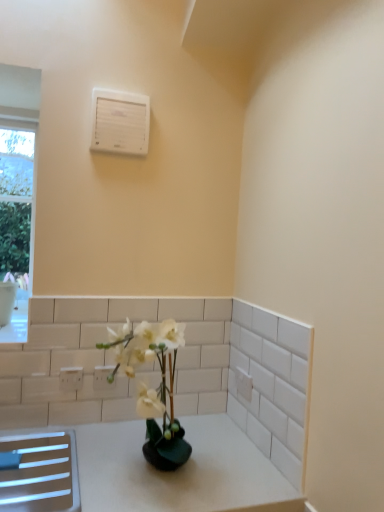
In order to face white glossy vase at center, should I rotate leftwards or rightwards?

Turn left approximately 5.754 degrees to face it.

Where is `white glossy vase at center`? The width and height of the screenshot is (384, 512). white glossy vase at center is located at coordinates click(x=151, y=388).

Between white glossy vase at center and white plastic electric outlet at lower left, the second electric outlet positioned from the back, which one is positioned behind?

white plastic electric outlet at lower left, the second electric outlet positioned from the back, is more distant.

Consider the image. Does white glossy vase at center have a lesser height compared to white plastic electric outlet at lower left, which is the first electric outlet from front to back?

No.

Does white glossy vase at center have a lesser width compared to white plastic electric outlet at lower left, which ranks as the 1th electric outlet in left-to-right order?

Incorrect, the width of white glossy vase at center is not less than that of white plastic electric outlet at lower left, which ranks as the 1th electric outlet in left-to-right order.

Would you say white glossy vase at center is inside or outside white plastic electric outlet at lower left, which is the first electric outlet from front to back?

white glossy vase at center is outside white plastic electric outlet at lower left, which is the first electric outlet from front to back.

Can you confirm if white plastic air conditioning unit at upper center is thinner than white plastic electric outlet at lower left, the second electric outlet in the right-to-left sequence?

No.

Image resolution: width=384 pixels, height=512 pixels. I want to click on the 2nd electric outlet located beneath the white plastic air conditioning unit at upper center (from a real-world perspective), so click(x=71, y=378).

Are white plastic air conditioning unit at upper center and white plastic electric outlet at lower left, which ranks as the 1th electric outlet in left-to-right order, beside each other?

No, white plastic air conditioning unit at upper center is not in contact with white plastic electric outlet at lower left, which ranks as the 1th electric outlet in left-to-right order.

Can you confirm if white plastic air conditioning unit at upper center is bigger than white plastic electric outlet at lower left, which ranks as the 1th electric outlet in left-to-right order?

Yes, white plastic air conditioning unit at upper center is bigger than white plastic electric outlet at lower left, which ranks as the 1th electric outlet in left-to-right order.

Find the location of `air conditioning on the right of white plastic electric outlet at lower left, the second electric outlet in the right-to-left sequence`. air conditioning on the right of white plastic electric outlet at lower left, the second electric outlet in the right-to-left sequence is located at coordinates pyautogui.click(x=120, y=122).

Consider the image. Is white plastic air conditioning unit at upper center a part of white plastic electric outlet at lower left, which is the first electric outlet from front to back?

No, white plastic air conditioning unit at upper center is located outside of white plastic electric outlet at lower left, which is the first electric outlet from front to back.

Does white plastic electric outlet at lower left, the second electric outlet in the right-to-left sequence, have a lesser width compared to white plastic air conditioning unit at upper center?

Correct, the width of white plastic electric outlet at lower left, the second electric outlet in the right-to-left sequence, is less than that of white plastic air conditioning unit at upper center.

Considering the sizes of white plastic electric outlet at lower left, which ranks as the 1th electric outlet in left-to-right order, and white plastic air conditioning unit at upper center in the image, is white plastic electric outlet at lower left, which ranks as the 1th electric outlet in left-to-right order, bigger or smaller than white plastic air conditioning unit at upper center?

Considering their sizes, white plastic electric outlet at lower left, which ranks as the 1th electric outlet in left-to-right order, takes up less space than white plastic air conditioning unit at upper center.

Would you say white plastic air conditioning unit at upper center is to the left or to the right of white glossy vase at center in the picture?

In the image, white plastic air conditioning unit at upper center appears on the left side of white glossy vase at center.

Considering the relative sizes of white plastic air conditioning unit at upper center and white glossy vase at center in the image provided, is white plastic air conditioning unit at upper center taller than white glossy vase at center?

In fact, white plastic air conditioning unit at upper center may be shorter than white glossy vase at center.

Is point (93, 113) behind point (158, 349)?

Yes, point (93, 113) is behind point (158, 349).

From a real-world perspective, which object stands above the other?

In real-world perspective, white plastic air conditioning unit at upper center is above.

At what (x,y) coordinates should I click in order to perform the action: click on houseplant on the right of white plastic air conditioning unit at upper center. Please return your answer as a coordinate pair (x, y). This screenshot has height=512, width=384. Looking at the image, I should click on (151, 388).

Is white glossy vase at center behind white plastic air conditioning unit at upper center?

No, it is not.

Is white glossy vase at center touching white plastic air conditioning unit at upper center?

No, white glossy vase at center is not touching white plastic air conditioning unit at upper center.

Considering the relative sizes of white glossy vase at center and white plastic air conditioning unit at upper center in the image provided, is white glossy vase at center wider than white plastic air conditioning unit at upper center?

Yes.

Which object is more forward, white plastic electric outlet at lower left, the second electric outlet in the front-to-back sequence, or white plastic air conditioning unit at upper center?

white plastic air conditioning unit at upper center is in front.

Is white plastic electric outlet at lower left, the second electric outlet in the front-to-back sequence, aimed at white plastic air conditioning unit at upper center?

No, white plastic electric outlet at lower left, the second electric outlet in the front-to-back sequence, is not aimed at white plastic air conditioning unit at upper center.

Would you consider white plastic electric outlet at lower left, the second electric outlet in the left-to-right sequence, to be distant from white plastic air conditioning unit at upper center?

No, white plastic electric outlet at lower left, the second electric outlet in the left-to-right sequence, is not far away from white plastic air conditioning unit at upper center.

From the picture: Who is shorter, white plastic electric outlet at lower left, which is the 1th electric outlet from back to front, or white plastic air conditioning unit at upper center?

Standing shorter between the two is white plastic electric outlet at lower left, which is the 1th electric outlet from back to front.

Looking at their sizes, would you say white plastic electric outlet at lower left, which is the first electric outlet from front to back, is wider or thinner than white plastic electric outlet at lower left, the second electric outlet in the left-to-right sequence?

In the image, white plastic electric outlet at lower left, which is the first electric outlet from front to back, appears to be more narrow than white plastic electric outlet at lower left, the second electric outlet in the left-to-right sequence.

From the image's perspective, is white plastic electric outlet at lower left, which ranks as the 1th electric outlet in left-to-right order, positioned above or below white plastic electric outlet at lower left, arranged as the 1th electric outlet when viewed from the right?

From the image's perspective, white plastic electric outlet at lower left, which ranks as the 1th electric outlet in left-to-right order, appears above white plastic electric outlet at lower left, arranged as the 1th electric outlet when viewed from the right.

Is white plastic electric outlet at lower left, which ranks as the 1th electric outlet in left-to-right order, completely or partially outside of white plastic electric outlet at lower left, the second electric outlet in the front-to-back sequence?

That's correct, white plastic electric outlet at lower left, which ranks as the 1th electric outlet in left-to-right order, is outside of white plastic electric outlet at lower left, the second electric outlet in the front-to-back sequence.

In order to click on electric outlet located in front of the white plastic electric outlet at lower left, the second electric outlet in the left-to-right sequence in this screenshot , I will do `click(71, 378)`.

Find the location of `the 1st electric outlet below the white glossy vase at center (from the image's perspective)`. the 1st electric outlet below the white glossy vase at center (from the image's perspective) is located at coordinates (71, 378).

From a real-world perspective, count 2nd electric outlets downward from the white plastic air conditioning unit at upper center and point to it. Please provide its 2D coordinates.

[(71, 378)]

Based on their spatial positions, is white plastic electric outlet at lower left, which is the first electric outlet from front to back, or white plastic electric outlet at lower left, arranged as the 1th electric outlet when viewed from the right, closer to white glossy vase at center?

white plastic electric outlet at lower left, arranged as the 1th electric outlet when viewed from the right, is positioned closer to the anchor white glossy vase at center.

Based on the photo, when comparing their distances from white plastic electric outlet at lower left, the second electric outlet in the right-to-left sequence, does white plastic electric outlet at lower left, the second electric outlet in the front-to-back sequence, or white glossy vase at center seem further?

white glossy vase at center lies further to white plastic electric outlet at lower left, the second electric outlet in the right-to-left sequence, than the other object.

Based on their spatial positions, is white plastic air conditioning unit at upper center or white plastic electric outlet at lower left, which is the 1th electric outlet from back to front, closer to white plastic electric outlet at lower left, which ranks as the 1th electric outlet in left-to-right order?

white plastic electric outlet at lower left, which is the 1th electric outlet from back to front, is positioned closer to the anchor white plastic electric outlet at lower left, which ranks as the 1th electric outlet in left-to-right order.

Looking at the image, which one is located further to white plastic electric outlet at lower left, the second electric outlet in the left-to-right sequence, white plastic air conditioning unit at upper center or white glossy vase at center?

white plastic air conditioning unit at upper center lies further to white plastic electric outlet at lower left, the second electric outlet in the left-to-right sequence, than the other object.

Based on their spatial positions, is white plastic electric outlet at lower left, the second electric outlet in the left-to-right sequence, or white plastic air conditioning unit at upper center further from white glossy vase at center?

white plastic air conditioning unit at upper center is positioned further to the anchor white glossy vase at center.

Consider the image. Estimate the real-world distances between objects in this image. Which object is further from white plastic electric outlet at lower left, the second electric outlet in the front-to-back sequence, white plastic electric outlet at lower left, the second electric outlet in the right-to-left sequence, or white glossy vase at center?

Among the two, white glossy vase at center is located further to white plastic electric outlet at lower left, the second electric outlet in the front-to-back sequence.

Considering their positions, is white glossy vase at center positioned further to white plastic air conditioning unit at upper center than white plastic electric outlet at lower left, which is the 1th electric outlet from back to front?

white plastic electric outlet at lower left, which is the 1th electric outlet from back to front, lies further to white plastic air conditioning unit at upper center than the other object.

Estimate the real-world distances between objects in this image. Which object is closer to white plastic electric outlet at lower left, which is the first electric outlet from front to back, white plastic electric outlet at lower left, the second electric outlet in the front-to-back sequence, or white plastic air conditioning unit at upper center?

Based on the image, white plastic electric outlet at lower left, the second electric outlet in the front-to-back sequence, appears to be nearer to white plastic electric outlet at lower left, which is the first electric outlet from front to back.

The height and width of the screenshot is (512, 384). I want to click on electric outlet between white plastic air conditioning unit at upper center and white plastic electric outlet at lower left, arranged as the 1th electric outlet when viewed from the right, from top to bottom, so click(x=71, y=378).

At what (x,y) coordinates should I click in order to perform the action: click on electric outlet between white glossy vase at center and white plastic electric outlet at lower left, the second electric outlet in the front-to-back sequence, in the front-back direction. Please return your answer as a coordinate pair (x, y). Looking at the image, I should click on (71, 378).

Where is `houseplant between white plastic air conditioning unit at upper center and white plastic electric outlet at lower left, which ranks as the 1th electric outlet in left-to-right order, in the vertical direction`? Image resolution: width=384 pixels, height=512 pixels. houseplant between white plastic air conditioning unit at upper center and white plastic electric outlet at lower left, which ranks as the 1th electric outlet in left-to-right order, in the vertical direction is located at coordinates (x=151, y=388).

The width and height of the screenshot is (384, 512). I want to click on houseplant that lies between white plastic air conditioning unit at upper center and white plastic electric outlet at lower left, which is the 1th electric outlet from back to front, from top to bottom, so click(x=151, y=388).